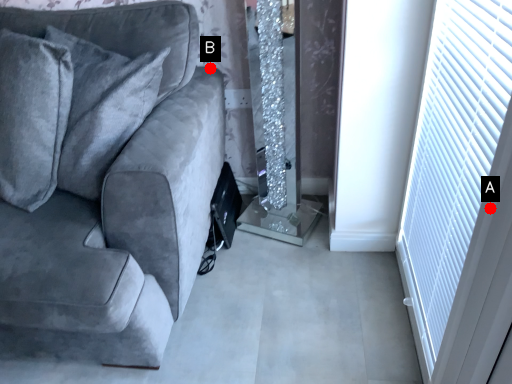
Question: Two points are circled on the image, labeled by A and B beside each circle. Which point is closer to the camera taking this photo?

Choices:
 (A) A is closer
 (B) B is closer

Answer: (A)